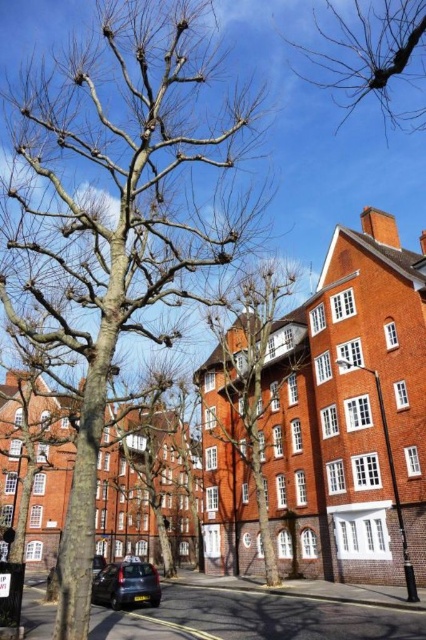
Is bare wood tree at center wider than bare branches at center?

Indeed, bare wood tree at center has a greater width compared to bare branches at center.

Locate an element on the screen. bare wood tree at center is located at coordinates (115, 218).

I want to click on bare wood tree at center, so click(115, 218).

Find the location of `bare wood tree at center`. bare wood tree at center is located at coordinates (115, 218).

Is bare branches at center below bare branches at upper right?

Indeed, bare branches at center is positioned under bare branches at upper right.

Does bare branches at center appear on the right side of bare branches at upper right?

Incorrect, bare branches at center is not on the right side of bare branches at upper right.

Where is `bare branches at center`? bare branches at center is located at coordinates (247, 385).

How much distance is there between bare wood tree at center and bare branches at upper right?

bare wood tree at center is 29.56 meters away from bare branches at upper right.

Is bare wood tree at center below bare branches at upper right?

Yes.

Does point (97, 273) lie in front of point (371, 38)?

Yes, it is in front of point (371, 38).

Where is `bare wood tree at center`? This screenshot has width=426, height=640. bare wood tree at center is located at coordinates (115, 218).